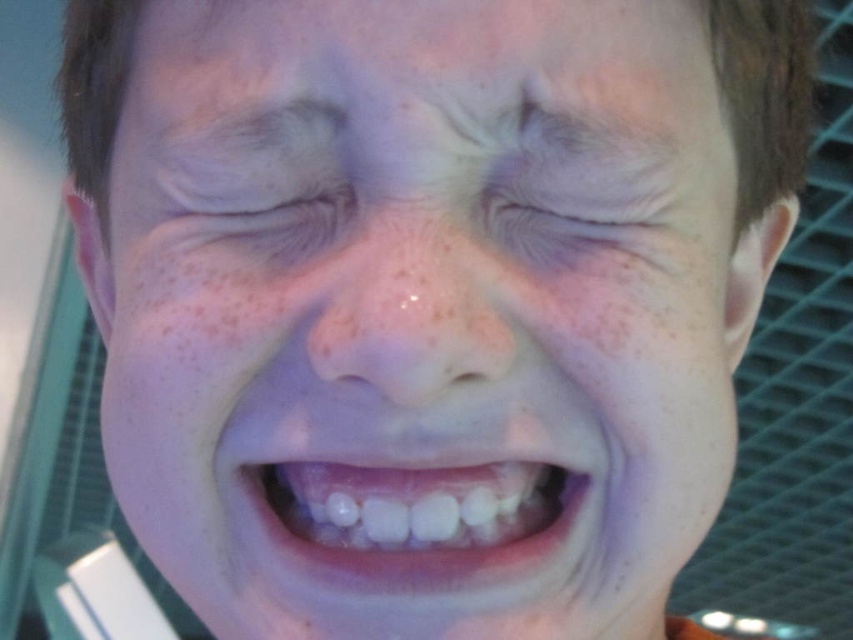
Question: Can you confirm if smooth skin face at center is bigger than white glossy teeth at center?

Choices:
 (A) yes
 (B) no

Answer: (A)

Question: Which point is farther to the camera?

Choices:
 (A) (570, 164)
 (B) (300, 314)
 (C) (459, 376)
 (D) (460, 476)

Answer: (D)

Question: Is white glossy teeth at center smaller than brown speckled freckle at upper left?

Choices:
 (A) no
 (B) yes

Answer: (B)

Question: Which of these objects is positioned closest to the pink matte nose at center?

Choices:
 (A) smooth skin face at center
 (B) dry skin at center
 (C) white glossy teeth at center
 (D) brown speckled freckle at upper left

Answer: (B)

Question: Among these objects, which one is farthest from the camera?

Choices:
 (A) white glossy teeth at center
 (B) smooth skin face at center

Answer: (A)

Question: Is white glossy teeth at center to the left of dry skin at center from the viewer's perspective?

Choices:
 (A) yes
 (B) no

Answer: (A)